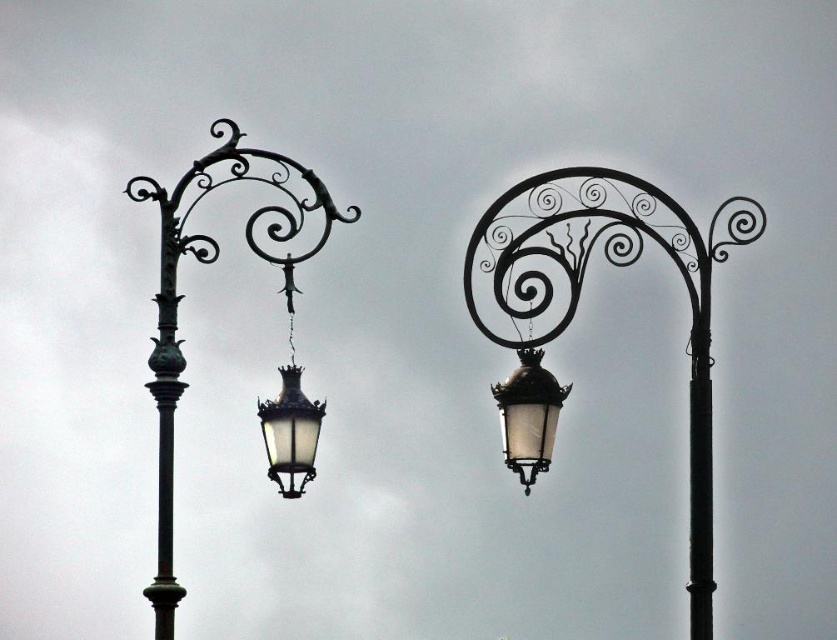
You are a city planner reviewing the design of these two street lamps. You need to ensure that the polished bronze pole at left and the matte black lantern at center are arranged in a way that the pole does not block the light from the lantern. Based on their positions, is there a potential issue with the current design?

The polished bronze pole at left is located below the matte black lantern at center, which means the pole could cast a shadow on the lantern, potentially blocking some of its light. This arrangement may create an issue with the current design as the pole might obstruct the lanterns illumination.

You are standing in front of the two street lamps. You want to touch the polished bronze pole at left and the matte black lantern at center. Which object will require you to reach further to touch?

The matte black lantern at center requires reaching further because the polished bronze pole at left is closer to the viewer.

Consider the image. You are a city planner assessing the placement of two street lamps. The polished bronze pole at left and the matte black lantern at center are part of a new design. Considering their heights, which object would cast a longer shadow during the day?

The polished bronze pole at left has a greater height compared to the matte black lantern at center, so it would cast a longer shadow during the day.